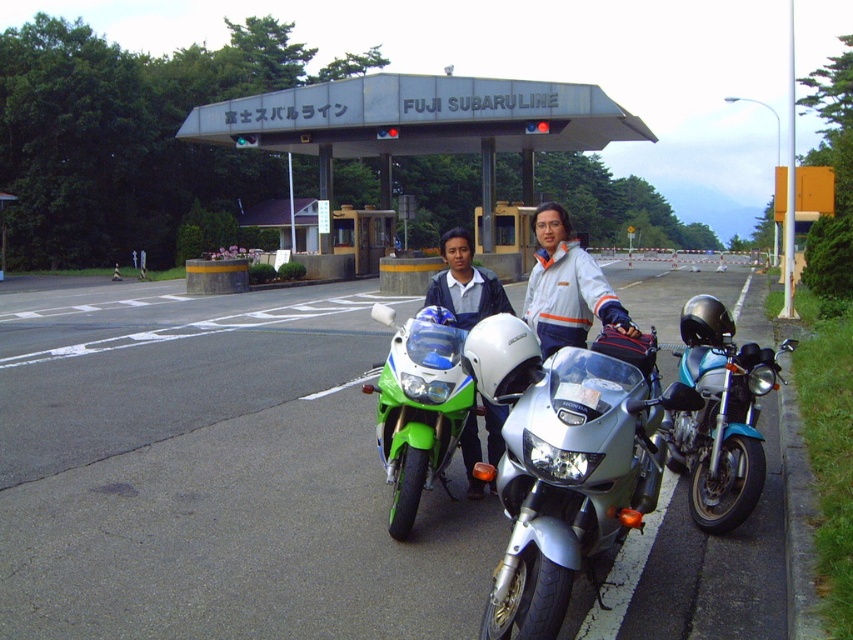
Who is positioned more to the left, green matte/satin motorcycle at center or matte blue helmet at center?

Positioned to the left is green matte/satin motorcycle at center.

Can you confirm if green matte/satin motorcycle at center is bigger than matte blue helmet at center?

No, green matte/satin motorcycle at center is not bigger than matte blue helmet at center.

Identify the location of green matte/satin motorcycle at center. The height and width of the screenshot is (640, 853). (419, 406).

Find the location of a particular element. The image size is (853, 640). green matte/satin motorcycle at center is located at coordinates (419, 406).

Is point (547, 221) behind point (426, 298)?

No, it is not.

Is white glossy helmet at center to the left of matte blue helmet at center from the viewer's perspective?

A: In fact, white glossy helmet at center is to the right of matte blue helmet at center.

Is point (583, 296) behind point (442, 250)?

No, it is in front of (442, 250).

You are a GUI agent. You are given a task and a screenshot of the screen. Output one action in this format:
    pyautogui.click(x=<x>, y=<y>)
    Task: Click on the white glossy helmet at center
    The image size is (853, 640).
    Given the screenshot: What is the action you would take?
    pyautogui.click(x=567, y=288)

Based on the photo, who is more distant from viewer, (554, 564) or (491, 429)?

The point (491, 429) is behind.

Is silver metallic motorcycle at center shorter than matte blue helmet at center?

Yes, silver metallic motorcycle at center is shorter than matte blue helmet at center.

Where is `silver metallic motorcycle at center`? This screenshot has width=853, height=640. silver metallic motorcycle at center is located at coordinates (563, 467).